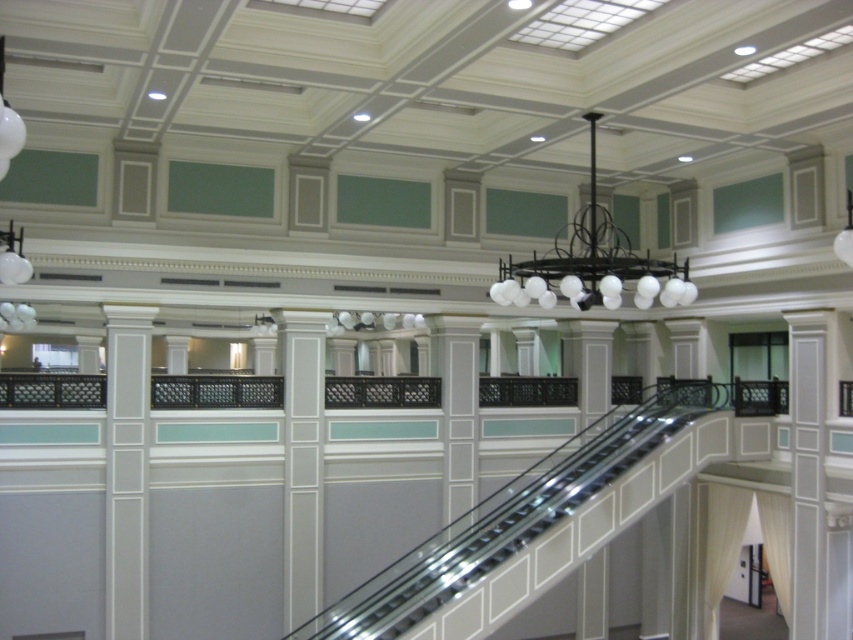
Does metallic escalator at center come in front of black matte chandelier at upper center?

No, metallic escalator at center is behind black matte chandelier at upper center.

Measure the distance from metallic escalator at center to black matte chandelier at upper center.

metallic escalator at center and black matte chandelier at upper center are 14.58 feet apart.

You are a GUI agent. You are given a task and a screenshot of the screen. Output one action in this format:
    pyautogui.click(x=<x>, y=<y>)
    Task: Click on the metallic escalator at center
    The image size is (853, 640).
    Given the screenshot: What is the action you would take?
    pyautogui.click(x=512, y=515)